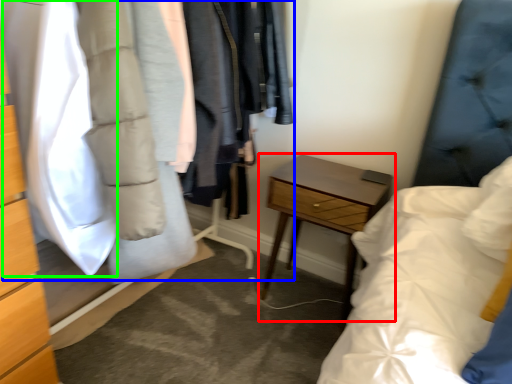
Question: Which object is positioned closest to nightstand (highlighted by a red box)? Select from closet (highlighted by a blue box) and clothing (highlighted by a green box).

Choices:
 (A) closet
 (B) clothing

Answer: (A)